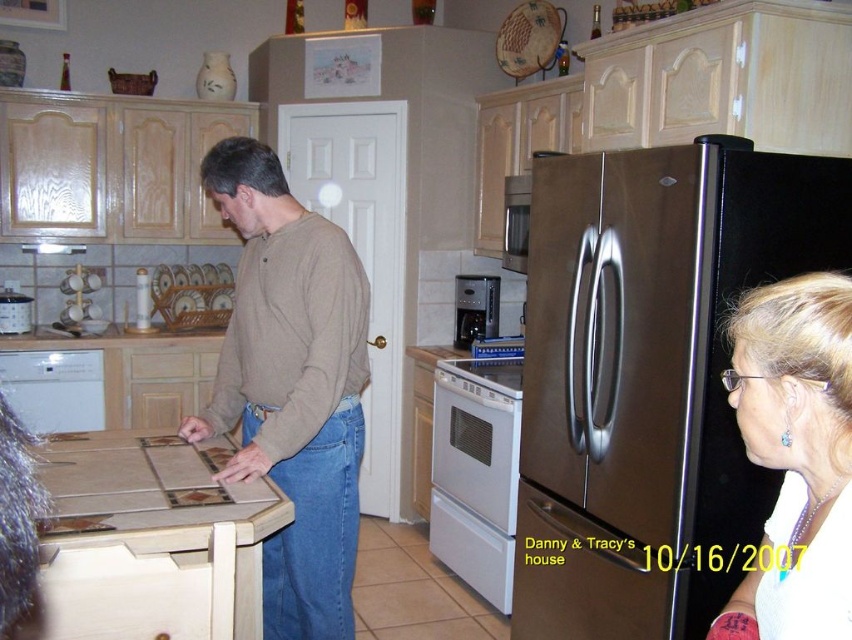
Question: Can you confirm if brown cotton sweater at center is wider than white glossy dishwasher at lower left?

Choices:
 (A) yes
 (B) no

Answer: (A)

Question: Which point appears farthest from the camera in this image?

Choices:
 (A) (280, 452)
 (B) (721, 360)
 (C) (16, 314)
 (D) (458, 419)

Answer: (C)

Question: Among these objects, which one is farthest from the camera?

Choices:
 (A) white glossy dishwasher at lower left
 (B) brushed metal coffee pot at left
 (C) white glossy oven at center
 (D) brown cotton sweater at center

Answer: (B)

Question: Is stainless steel refrigerator at right smaller than brown cotton sweater at center?

Choices:
 (A) yes
 (B) no

Answer: (B)

Question: Which object is positioned closest to the stainless steel refrigerator at right?

Choices:
 (A) white glossy dishwasher at lower left
 (B) satin silver microwave at center
 (C) brown cotton sweater at center
 (D) white glossy hair at upper right

Answer: (C)

Question: Can you confirm if stainless steel refrigerator at right is positioned above white glossy dishwasher at lower left?

Choices:
 (A) yes
 (B) no

Answer: (A)